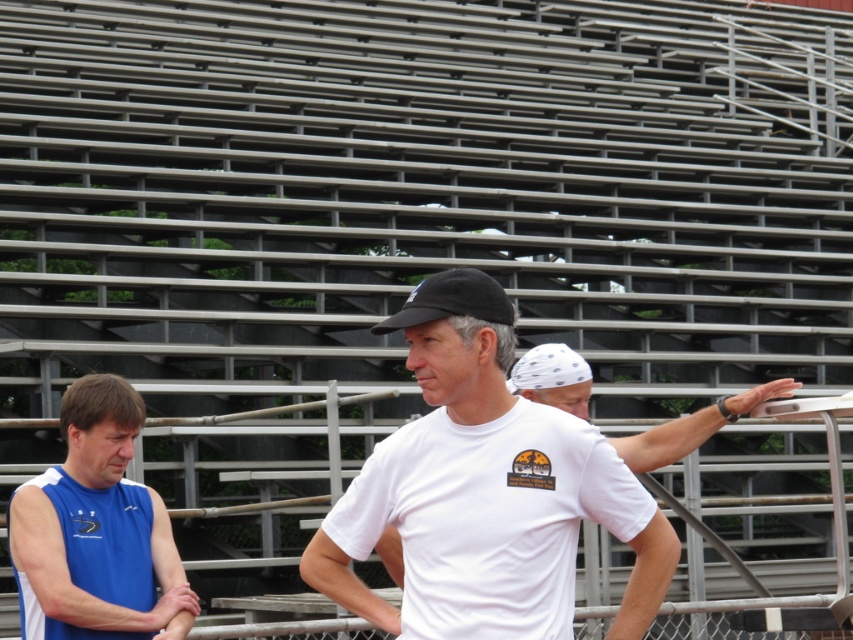
Question: Which object is farther from the camera taking this photo?

Choices:
 (A) black matte baseball cap at center
 (B) blue sleeveless shirt at left

Answer: (B)

Question: Which point is closer to the camera?

Choices:
 (A) white matte t-shirt at center
 (B) black matte baseball cap at center

Answer: (A)

Question: Does blue sleeveless shirt at left lie behind black matte baseball cap at center?

Choices:
 (A) no
 (B) yes

Answer: (B)

Question: Can you confirm if white matte t-shirt at center is positioned above black matte baseball cap at center?

Choices:
 (A) no
 (B) yes

Answer: (A)

Question: Which point is closer to the camera?

Choices:
 (A) (21, 522)
 (B) (410, 324)
 (C) (624, 492)

Answer: (B)

Question: Is white matte t-shirt at center wider than black matte baseball cap at center?

Choices:
 (A) no
 (B) yes

Answer: (B)